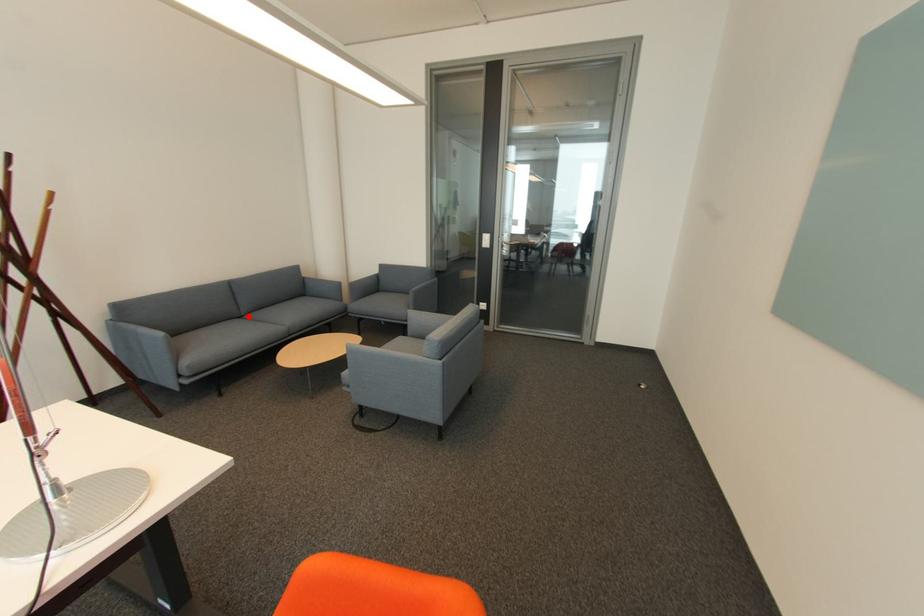
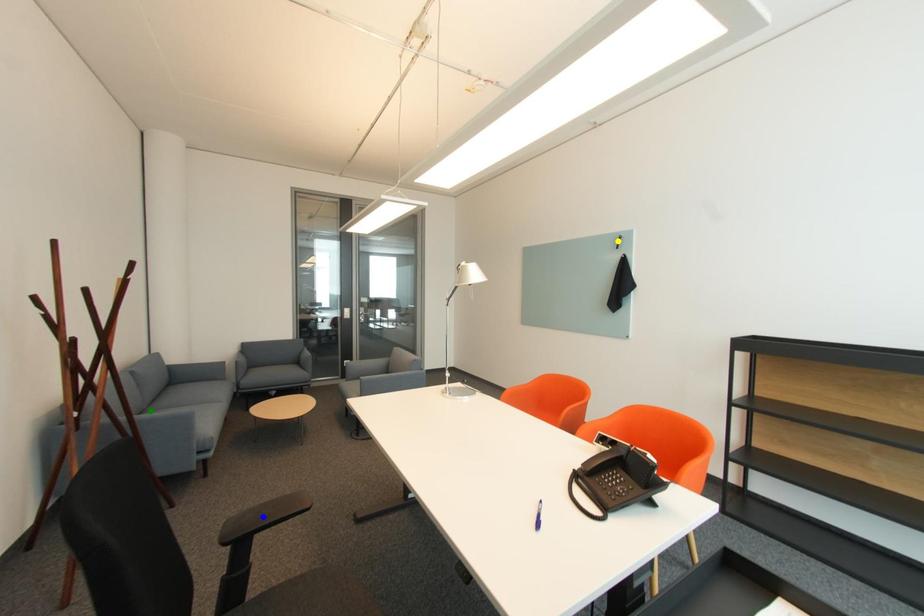
Question: I am providing you with two images of the same scene from different viewpoints. A red point is marked on the first image. You are given multiple points on the second image. Which point in image 2 represents the same 3d spot as the red point in image 1?

Choices:
 (A) blue point
 (B) green point
 (C) yellow point

Answer: (B)